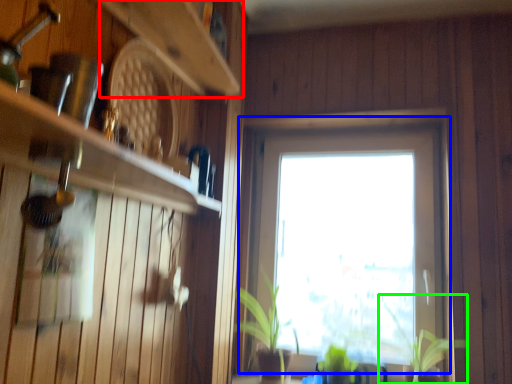
Question: Which object is the farthest from shelf (highlighted by a red box)? Choose among these: window (highlighted by a blue box) or plant (highlighted by a green box).

Choices:
 (A) window
 (B) plant

Answer: (B)